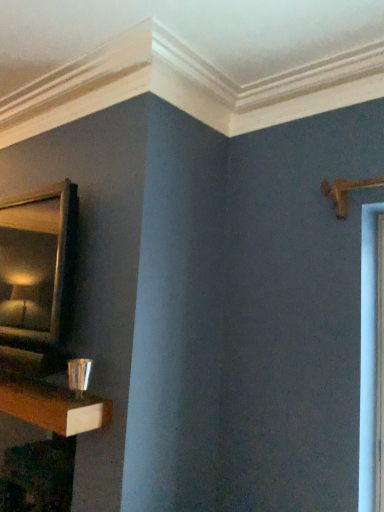
Question: Is wooden table at lower left oriented towards shiny metallic cup at lower left?

Choices:
 (A) no
 (B) yes

Answer: (A)

Question: From the image's perspective, is wooden table at lower left on shiny metallic cup at lower left?

Choices:
 (A) no
 (B) yes

Answer: (A)

Question: Can you see wooden table at lower left touching shiny metallic cup at lower left?

Choices:
 (A) yes
 (B) no

Answer: (A)

Question: Does wooden table at lower left have a greater width compared to shiny metallic cup at lower left?

Choices:
 (A) yes
 (B) no

Answer: (A)

Question: Can you confirm if wooden table at lower left is smaller than shiny metallic cup at lower left?

Choices:
 (A) no
 (B) yes

Answer: (A)

Question: Can you confirm if wooden table at lower left is taller than shiny metallic cup at lower left?

Choices:
 (A) yes
 (B) no

Answer: (A)

Question: Is wooden table at lower left bigger than gold-framed mirror at upper left?

Choices:
 (A) no
 (B) yes

Answer: (B)

Question: Is wooden table at lower left wider than gold-framed mirror at upper left?

Choices:
 (A) no
 (B) yes

Answer: (B)

Question: From the image's perspective, does wooden table at lower left appear lower than gold-framed mirror at upper left?

Choices:
 (A) yes
 (B) no

Answer: (A)

Question: Is wooden table at lower left at the left side of gold-framed mirror at upper left?

Choices:
 (A) yes
 (B) no

Answer: (B)

Question: Can gold-framed mirror at upper left be found inside wooden table at lower left?

Choices:
 (A) yes
 (B) no

Answer: (B)

Question: From a real-world perspective, is wooden table at lower left under gold-framed mirror at upper left?

Choices:
 (A) yes
 (B) no

Answer: (A)

Question: Can you confirm if gold-framed mirror at upper left is positioned to the left of shiny metallic cup at lower left?

Choices:
 (A) no
 (B) yes

Answer: (B)